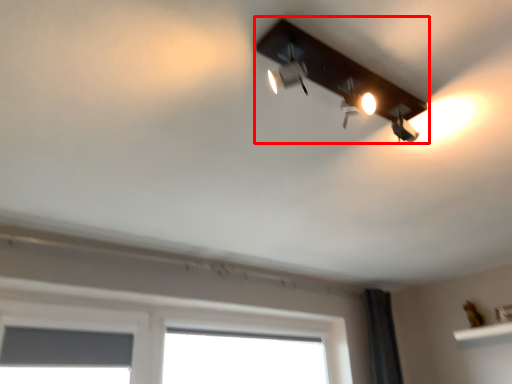
Question: From the image's perspective, what is the correct spatial relationship of lamp (annotated by the red box) in relation to window screen?

Choices:
 (A) above
 (B) below

Answer: (A)